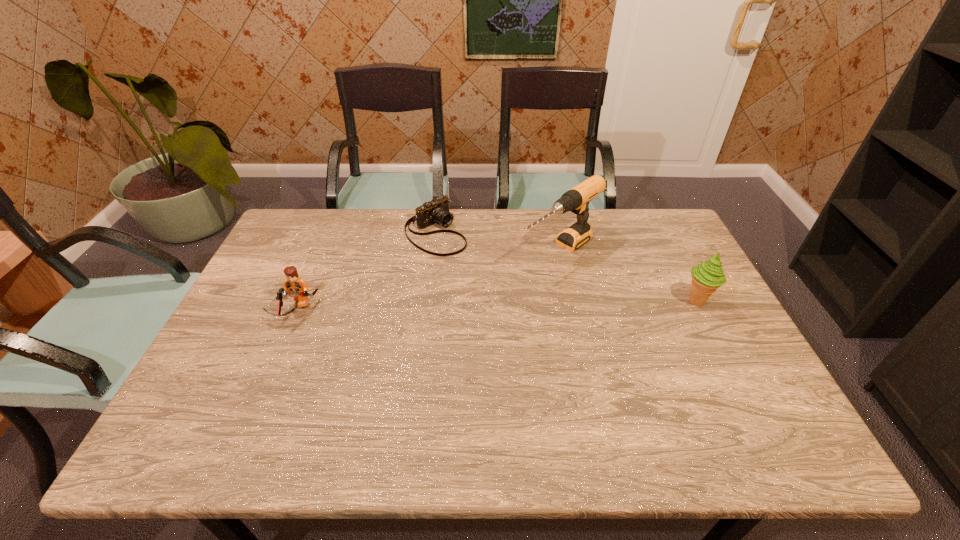
Identify the location of vacant space at the far edge of the desktop. (396, 211).

In the image, there is a desktop. At what (x,y) coordinates should I click in order to perform the action: click on vacant space at the left edge. Please return your answer as a coordinate pair (x, y). Looking at the image, I should click on (310, 256).

This screenshot has width=960, height=540. I want to click on vacant area at the right edge of the desktop, so click(723, 339).

This screenshot has height=540, width=960. Identify the location of vacant region at the far left corner of the desktop. (312, 218).

I want to click on vacant area at the near left corner, so click(252, 396).

Identify the location of vacant space at the far right corner of the desktop. This screenshot has height=540, width=960. (646, 231).

Locate an element on the screen. The height and width of the screenshot is (540, 960). free space between the drill and the rightmost object is located at coordinates (629, 276).

In order to click on blank region between the second object from right to left and the second tallest object in this screenshot , I will do [x=629, y=276].

This screenshot has height=540, width=960. Identify the location of empty space that is in between the drill and the rightmost object. (629, 276).

You are a GUI agent. You are given a task and a screenshot of the screen. Output one action in this format:
    pyautogui.click(x=<x>, y=<y>)
    Task: Click on the free space between the tallest object and the rightmost object
    The width and height of the screenshot is (960, 540).
    Given the screenshot: What is the action you would take?
    pyautogui.click(x=629, y=276)